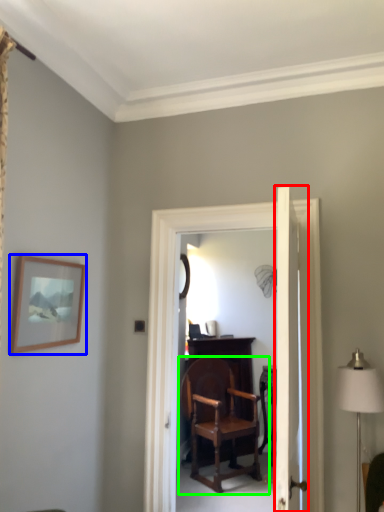
Question: Based on their relative distances, which object is nearer to door (highlighted by a red box)? Choose from picture frame (highlighted by a blue box) and chair (highlighted by a green box).

Choices:
 (A) picture frame
 (B) chair

Answer: (A)